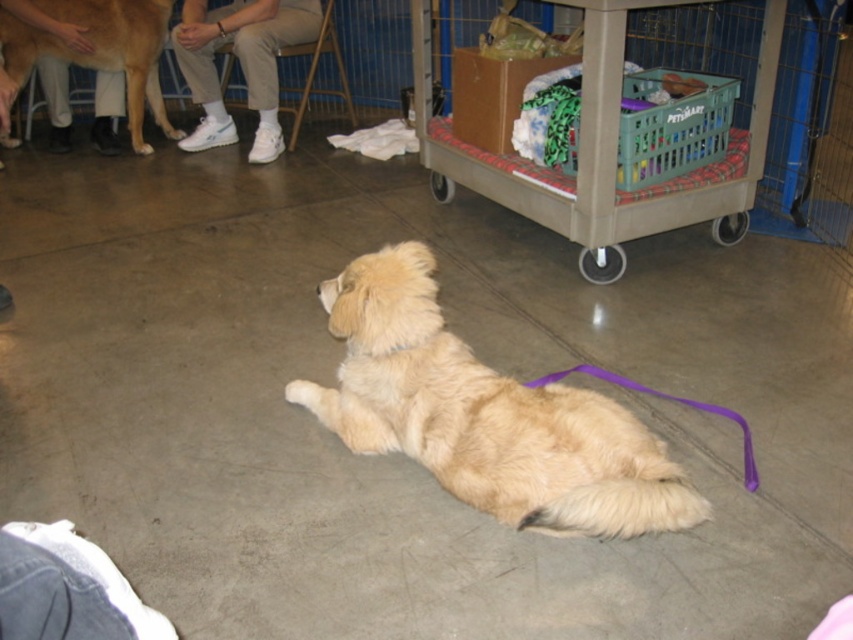
Question: Is plastic crate at center smaller than golden fur dog at upper left?

Choices:
 (A) yes
 (B) no

Answer: (B)

Question: Among these objects, which one is farthest from the camera?

Choices:
 (A) plastic crate at center
 (B) white fabric pants at upper left

Answer: (B)

Question: Where is plastic crate at center located in relation to golden fur dog at upper left in the image?

Choices:
 (A) below
 (B) above

Answer: (A)

Question: Which object is farther from the camera taking this photo?

Choices:
 (A) golden fur dog at upper left
 (B) golden fur dog at center
 (C) plastic crate at center

Answer: (A)

Question: Which point is closer to the camera taking this photo?

Choices:
 (A) (212, 42)
 (B) (589, 20)
 (C) (137, 58)
 (D) (572, 502)

Answer: (D)

Question: Observing the image, what is the correct spatial positioning of white fabric pants at upper left in reference to golden fur dog at upper left?

Choices:
 (A) right
 (B) left

Answer: (A)